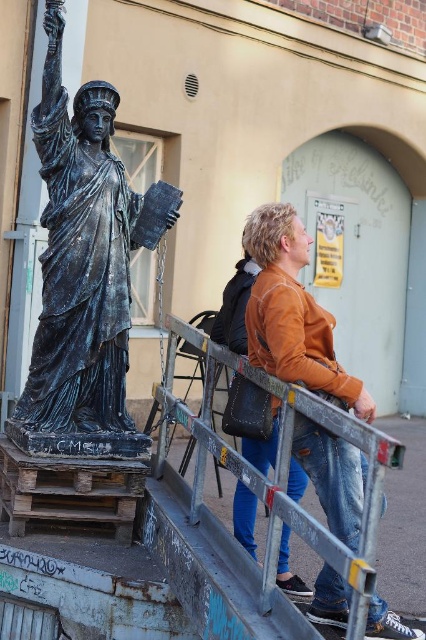
You are standing at the base of the bronze statue at left and want to see the person in the orange leather jacket at upper right. Which direction should you look to see them?

The bronze statue at left is positioned over the orange leather jacket at upper right, so you should look to your right and below the bronze statue at left to see the person in the orange leather jacket at upper right.

Consider the image. You are a photographer trying to capture both the bronze statue at left and the orange leather jacket at upper right in the same frame. Based on their sizes, which object should you position closer to the camera to ensure both fit well in the photo?

Since the bronze statue at left is wider than the orange leather jacket at upper right, you should position the bronze statue at left closer to the camera to ensure both fit well in the photo.